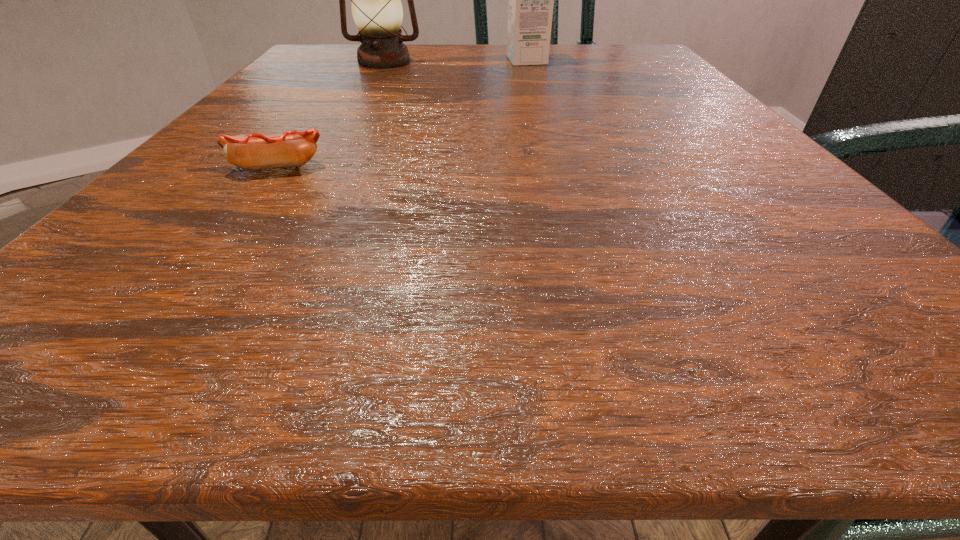
What are the coordinates of `oil lamp that is positioned at the left edge` in the screenshot? It's located at (377, 11).

I want to click on sausage located in the left edge section of the desktop, so click(x=289, y=149).

The image size is (960, 540). In order to click on object located in the far left corner section of the desktop in this screenshot , I will do `click(377, 11)`.

Identify the location of free region at the far edge of the desktop. (421, 65).

Identify the location of vacant space at the near edge of the desktop. Image resolution: width=960 pixels, height=540 pixels. [x=686, y=297].

Where is `free space at the left edge`? The width and height of the screenshot is (960, 540). free space at the left edge is located at coordinates (91, 261).

Image resolution: width=960 pixels, height=540 pixels. In order to click on free location at the right edge in this screenshot , I will do `click(675, 136)`.

The width and height of the screenshot is (960, 540). I want to click on vacant region at the far left corner of the desktop, so click(353, 50).

Image resolution: width=960 pixels, height=540 pixels. In the image, there is a desktop. Identify the location of vacant space at the near right corner. (936, 349).

Identify the location of free space between the shortest object and the oil lamp. 331,114.